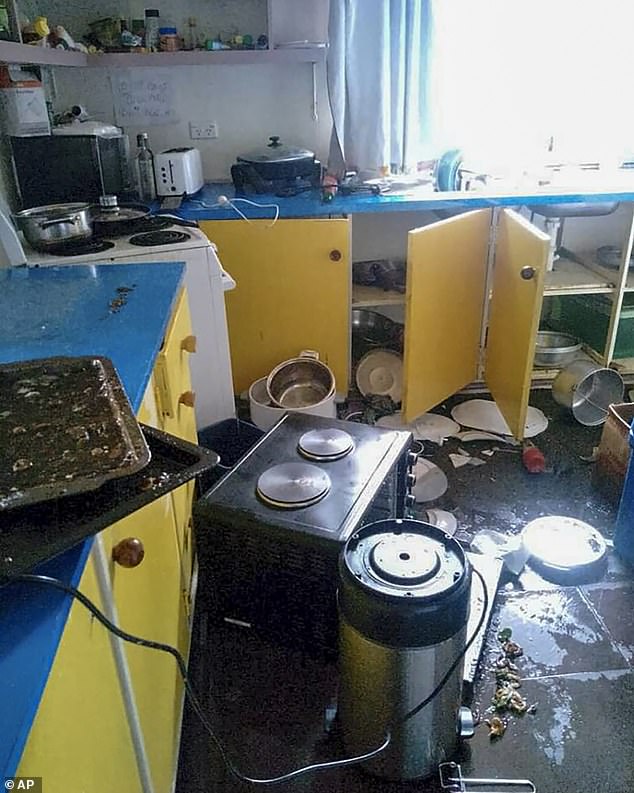
Find the location of a particular element. The height and width of the screenshot is (793, 634). electrical cords is located at coordinates (130, 642), (226, 201).